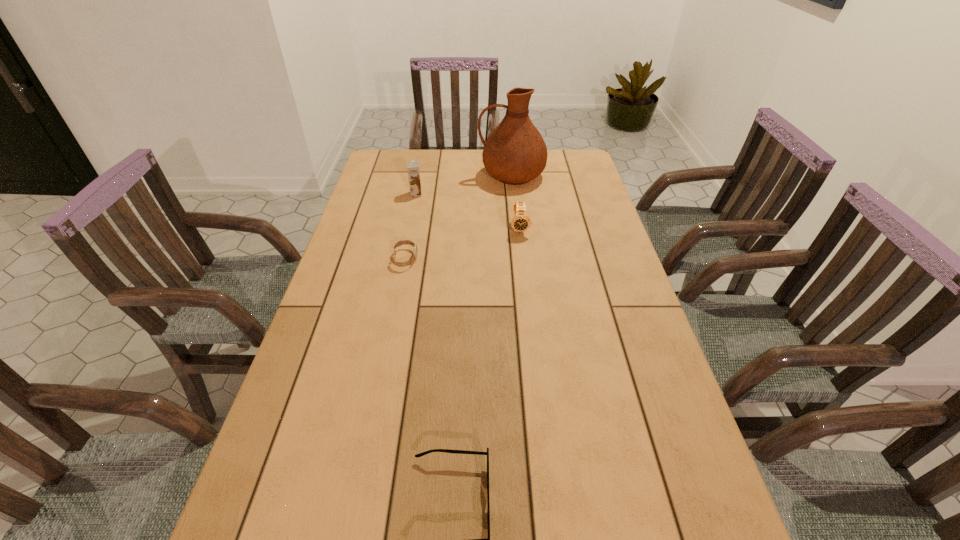
Locate an element on the screen. vacant position located on the face of the taller watch is located at coordinates (531, 328).

Locate an element on the screen. The height and width of the screenshot is (540, 960). free space located on the face of the fourth farthest object is located at coordinates (458, 259).

Find the location of `object positioned at the far edge`. object positioned at the far edge is located at coordinates (514, 153).

The image size is (960, 540). I want to click on vacant space at the left edge of the desktop, so click(x=350, y=238).

Locate an element on the screen. This screenshot has height=540, width=960. vacant space at the right edge is located at coordinates (605, 357).

Locate an element on the screen. vacant region at the far right corner of the desktop is located at coordinates (559, 168).

You are a GUI agent. You are given a task and a screenshot of the screen. Output one action in this format:
    pyautogui.click(x=<x>, y=<y>)
    Task: Click on the free space between the fourth shortest object and the right watch
    The width and height of the screenshot is (960, 540).
    Given the screenshot: What is the action you would take?
    pyautogui.click(x=468, y=211)

Where is `the third closest object to the right watch`? The image size is (960, 540). the third closest object to the right watch is located at coordinates (413, 167).

The height and width of the screenshot is (540, 960). Find the location of `object that can be found as the third closest to the third tallest object`. object that can be found as the third closest to the third tallest object is located at coordinates (413, 167).

Point out which watch is positioned as the nearest to the nearest object. Please provide its 2D coordinates. Your answer should be formatted as a tuple, i.e. [(x, y)], where the tuple contains the x and y coordinates of a point satisfying the conditions above.

[(405, 242)]